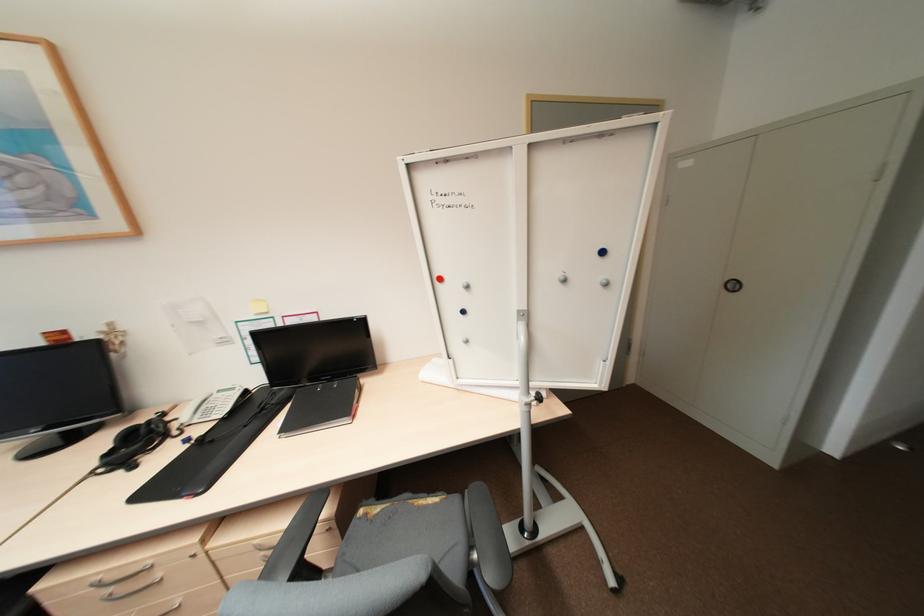
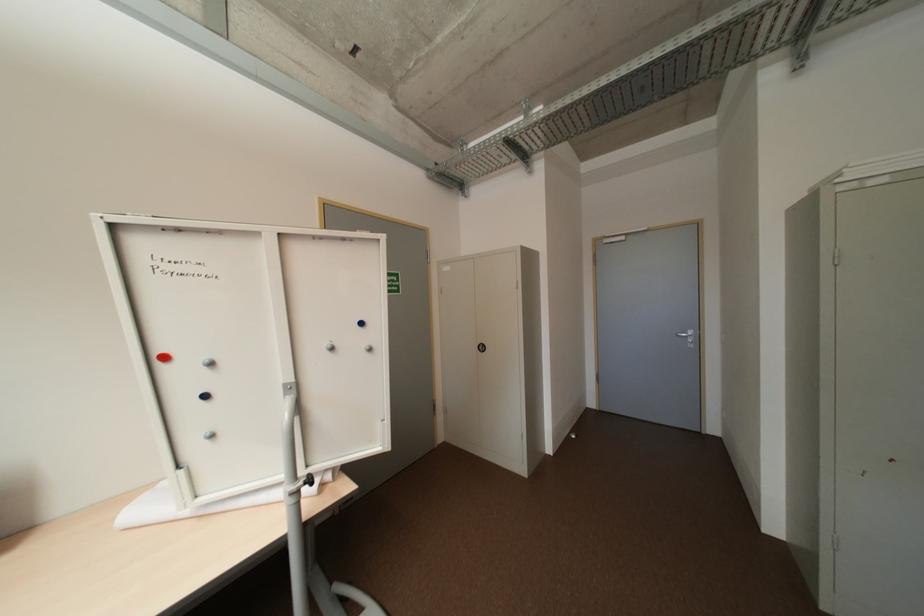
The images are taken continuously from a first-person perspective. In which direction is your viewpoint rotating?

The camera's rotation is toward right-up.